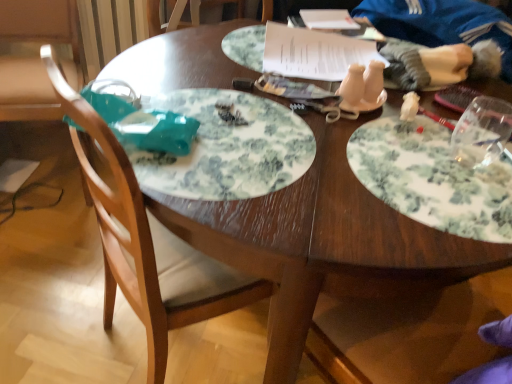
Question: Can you confirm if white paper at upper center is smaller than white fabric doll at upper right?

Choices:
 (A) no
 (B) yes

Answer: (B)

Question: Is white paper at upper center bigger than white fabric doll at upper right?

Choices:
 (A) no
 (B) yes

Answer: (A)

Question: Can you confirm if white paper at upper center is shorter than white fabric doll at upper right?

Choices:
 (A) yes
 (B) no

Answer: (A)

Question: Does white paper at upper center come in front of white fabric doll at upper right?

Choices:
 (A) yes
 (B) no

Answer: (B)

Question: Is white fabric doll at upper right inside white paper at upper center?

Choices:
 (A) yes
 (B) no

Answer: (B)

Question: From a real-world perspective, is wooden chair at left positioned above or below white floral plate at center, placed as the first plate when sorted from left to right?

Choices:
 (A) above
 (B) below

Answer: (B)

Question: Considering the positions of wooden chair at left and white floral plate at center, which is the second plate from right to left, in the image, is wooden chair at left wider or thinner than white floral plate at center, which is the second plate from right to left,?

Choices:
 (A) thin
 (B) wide

Answer: (B)

Question: Based on their sizes in the image, would you say wooden chair at left is bigger or smaller than white floral plate at center, placed as the first plate when sorted from left to right?

Choices:
 (A) big
 (B) small

Answer: (A)

Question: Is point (105, 274) positioned closer to the camera than point (242, 100)?

Choices:
 (A) closer
 (B) farther

Answer: (B)

Question: From a real-world perspective, is white floral plate at right, acting as the 2th plate starting from the left, positioned above or below white floral plate at center, placed as the first plate when sorted from left to right?

Choices:
 (A) below
 (B) above

Answer: (B)

Question: Considering their positions, is white floral plate at right, the first plate when ordered from right to left, located in front of or behind white floral plate at center, placed as the first plate when sorted from left to right?

Choices:
 (A) behind
 (B) front

Answer: (B)

Question: Considering the positions of point (426, 145) and point (145, 100), is point (426, 145) closer or farther from the camera than point (145, 100)?

Choices:
 (A) farther
 (B) closer

Answer: (A)

Question: Based on their positions, is white floral plate at right, the first plate when ordered from right to left, located to the left or right of white floral plate at center, which is the second plate from right to left?

Choices:
 (A) left
 (B) right

Answer: (B)

Question: Considering their positions, is white paper at upper center located in front of or behind white floral plate at right, acting as the 2th plate starting from the left?

Choices:
 (A) front
 (B) behind

Answer: (B)

Question: Which is correct: white paper at upper center is inside white floral plate at right, acting as the 2th plate starting from the left, or outside of it?

Choices:
 (A) outside
 (B) inside

Answer: (A)